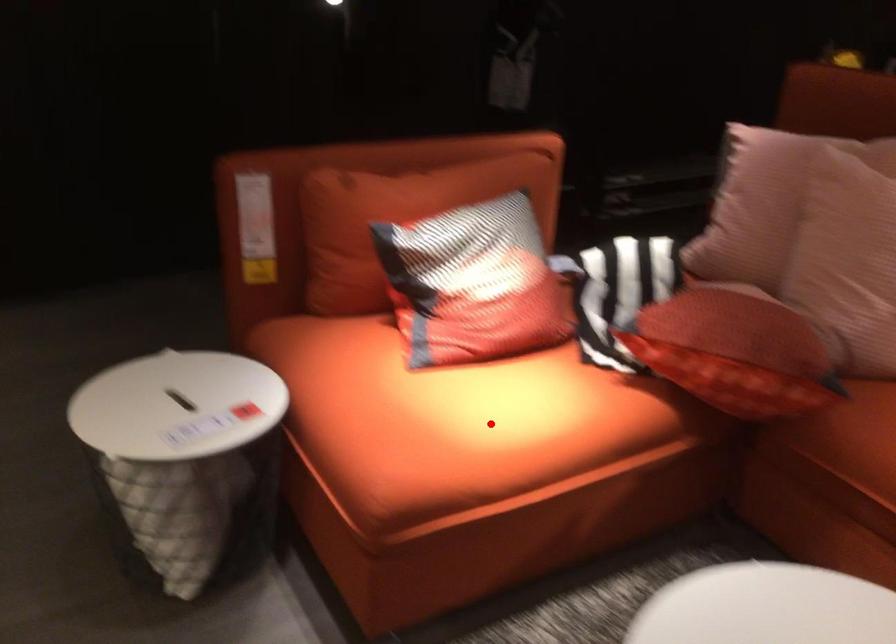
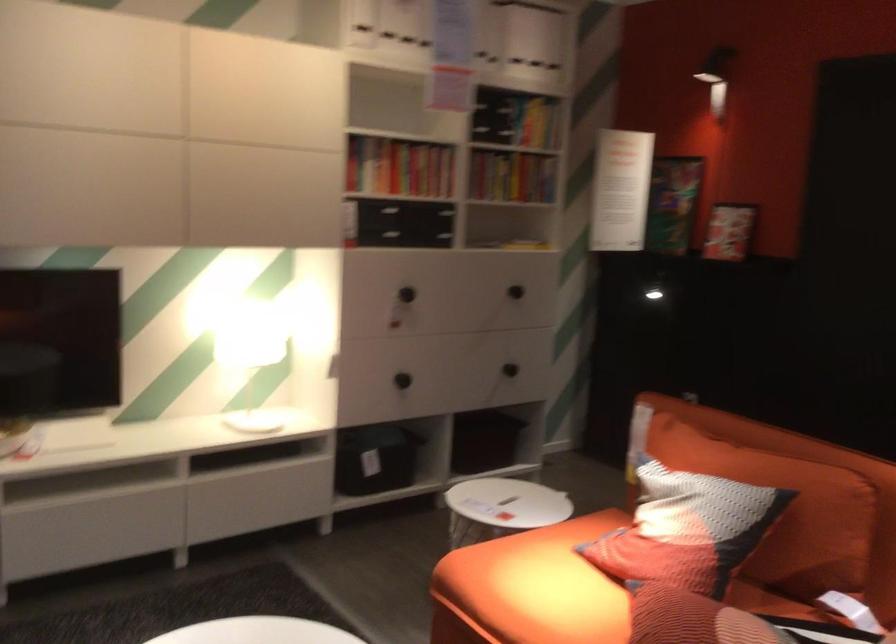
Find the pixel in the second image that matches the highlighted location in the first image.

(531, 588)